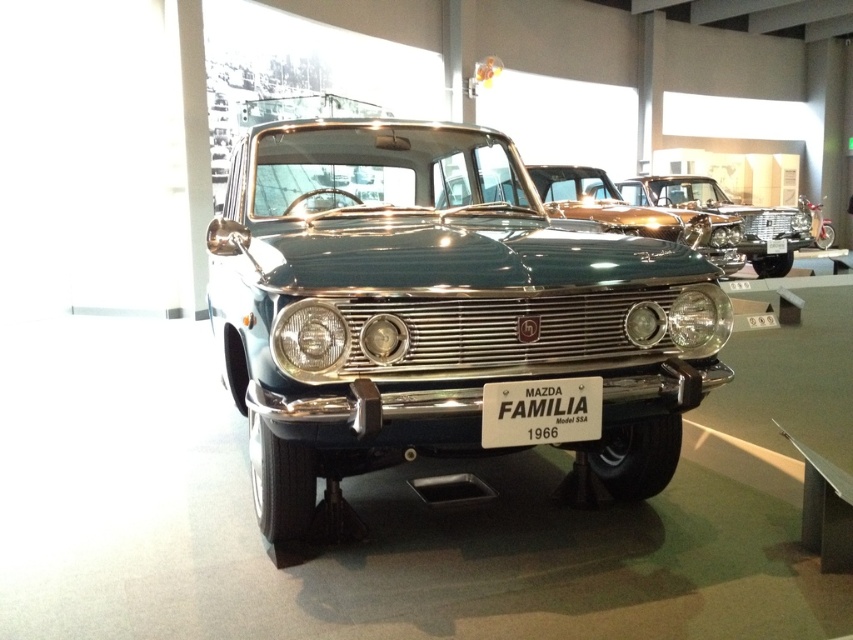
Question: Estimate the real-world distances between objects in this image. Which object is farther from the gold shiny car at upper center?

Choices:
 (A) shiny metallic car at center
 (B) white plastic license plate at center
 (C) matte chrome headlight at center
 (D) metallic teal car at center

Answer: (B)

Question: Considering the real-world distances, which object is farthest from the shiny metallic car at center?

Choices:
 (A) metallic teal car at center
 (B) clear glass headlight at center
 (C) gold shiny car at upper center

Answer: (B)

Question: Can you confirm if metallic teal car at center is thinner than white plastic license plate at center?

Choices:
 (A) no
 (B) yes

Answer: (A)

Question: Observing the image, what is the correct spatial positioning of metallic teal car at center in reference to clear glass headlight at center?

Choices:
 (A) above
 (B) below

Answer: (A)

Question: Is metallic teal car at center thinner than shiny metallic car at center?

Choices:
 (A) no
 (B) yes

Answer: (A)

Question: Which object is closer to the camera taking this photo?

Choices:
 (A) white plastic license plate at center
 (B) matte chrome headlight at center
 (C) gold shiny car at upper center
 (D) clear glass headlight at center

Answer: (D)